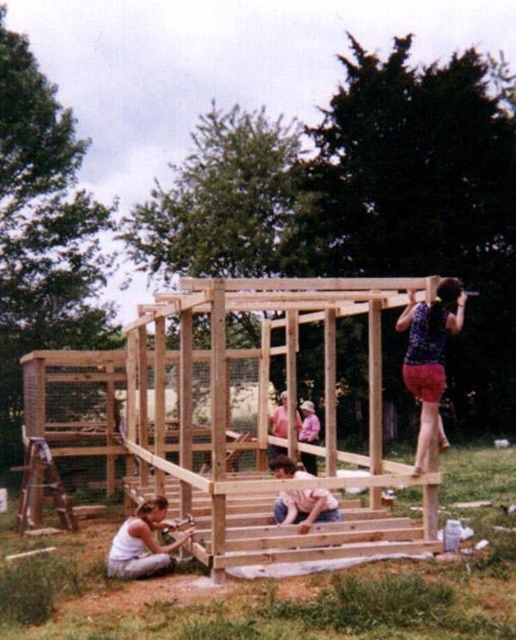
Question: Does white fabric construction worker at lower left appear under pink fabric shirt at center?

Choices:
 (A) no
 (B) yes

Answer: (B)

Question: Which object is farther from the camera taking this photo?

Choices:
 (A) spotted fabric shorts at upper right
 (B) pink fabric shirt at center
 (C) white fabric construction worker at lower left

Answer: (B)

Question: Is light brown wood frame at center below pink fabric shirt at center?

Choices:
 (A) yes
 (B) no

Answer: (B)

Question: Is spotted fabric shorts at upper right in front of pink fabric shirt at center?

Choices:
 (A) no
 (B) yes

Answer: (B)

Question: Which object is farther from the camera taking this photo?

Choices:
 (A) pink fabric shirt at center
 (B) pink cotton shirt at center

Answer: (A)

Question: Which point is farther from the camera taking this photo?

Choices:
 (A) (305, 504)
 (B) (427, 416)
 (C) (223, 513)

Answer: (A)